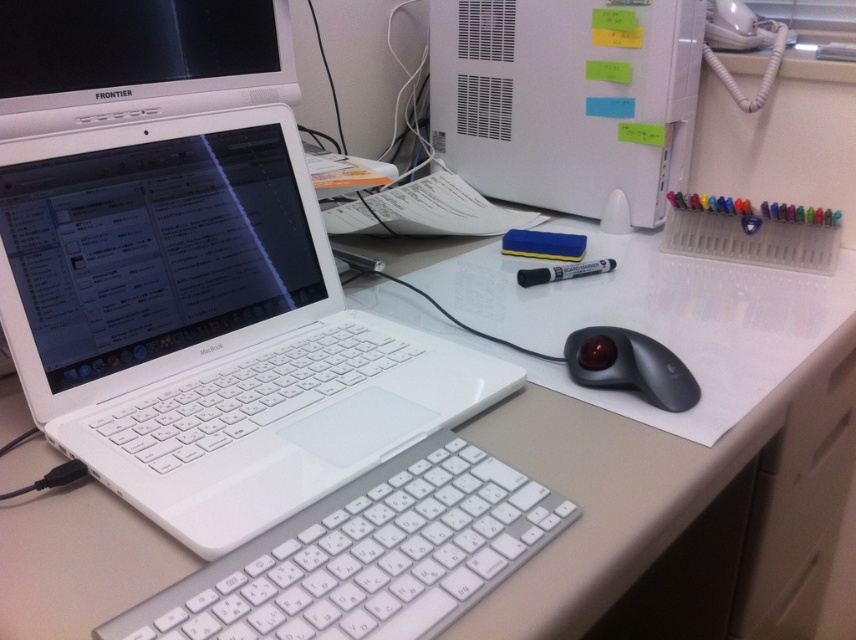
You are organizing your desk and need to place a 25 inch laptop stand between the white glossy laptop at left and the white matte desktop computer at upper center. Will there be enough space for the stand?

The distance between the white glossy laptop at left and the white matte desktop computer at upper center is 24.90 inches. Since the laptop stand is 25 inches wide, there is not enough space to place it between them.

You are organizing the desk and want to place a new item between the white glossy laptop at left and the white matte desktop computer at upper center. Is there enough vertical space between them to fit a 10cm tall object?

The white glossy laptop at left is below the white matte desktop computer at upper center, so there is vertical space between them. Since the object is only 10cm tall, it should fit between them vertically.

You are organizing the desk and want to move the white plastic keyboard at center closer to the white glossy laptop at left. Based on their current positions, can you move the keyboard forward without it overlapping the laptop?

The white plastic keyboard at center is currently behind the white glossy laptop at left. Moving it forward would bring it closer to the laptop without overlapping since it can slide in front of the laptop.